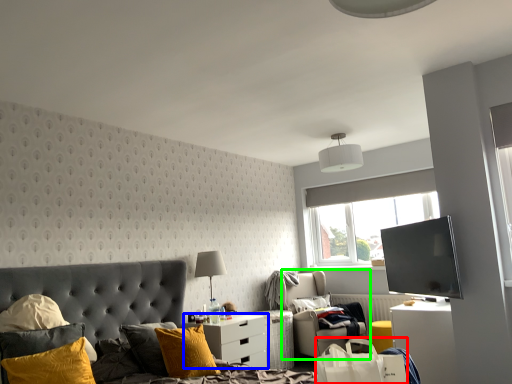
Question: Which object is the farthest from shopping bag (highlighted by a red box)? Choose among these: nightstand (highlighted by a blue box) or chair (highlighted by a green box).

Choices:
 (A) nightstand
 (B) chair

Answer: (B)